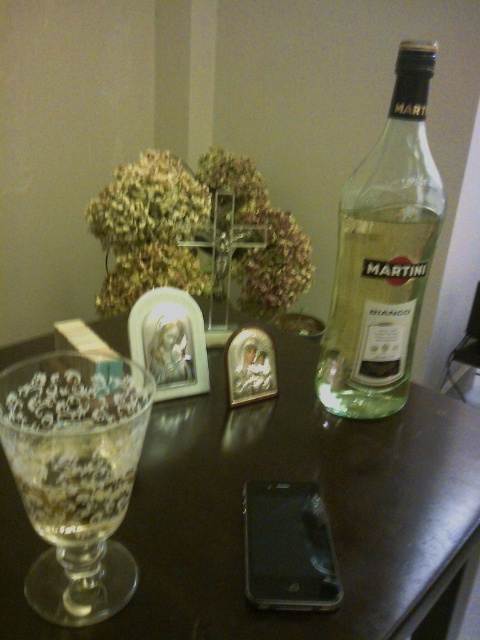
You are standing at the edge of the table and want to reach both points on the table. Which point, point (389, 282) or point (286, 483), will you reach first?

Point (389, 282) is further to the viewer than point (286, 483), so you will reach point (389, 282) first because it is closer to you.

Consider the image. You are a delivery person who needs to place a small package on the table. The package must be placed exactly at the coordinates given for the clear glass bottle at right. Where should you place the package relative to the other items on the table?

The clear glass bottle at right is located at coordinates point (x=384, y=253), so you should place the package at those coordinates relative to the other items on the table.